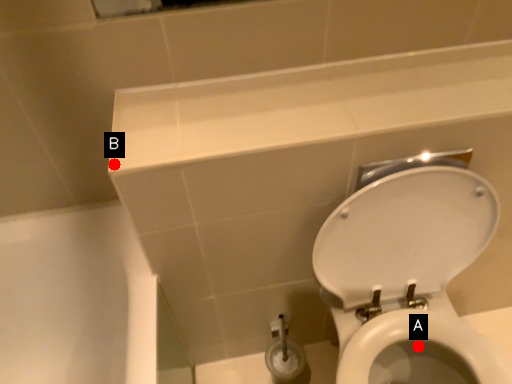
Question: Two points are circled on the image, labeled by A and B beside each circle. Which point appears closest to the camera in this image?

Choices:
 (A) A is closer
 (B) B is closer

Answer: (B)